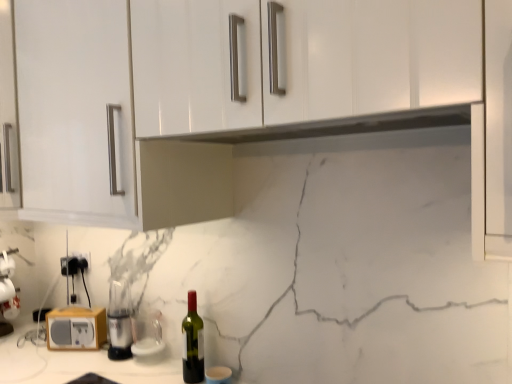
Question: Looking at the image, does black plastic electric outlet at lower left, which is the first electric outlet in right-to-left order, seem bigger or smaller compared to transparent glass at lower center, arranged as the third appliance when viewed from the left?

Choices:
 (A) small
 (B) big

Answer: (A)

Question: Is point (84, 258) closer or farther from the camera than point (159, 357)?

Choices:
 (A) farther
 (B) closer

Answer: (A)

Question: Estimate the real-world distances between objects in this image. Which object is closer to the green glass bottle at center?

Choices:
 (A) metallic silver blender at center, the 2th appliance from the left
 (B) translucent plastic blender at lower left
 (C) wooden radio at lower left, acting as the first appliance starting from the left
 (D) black plastic electric outlet at lower left, the 1th electric outlet in the left-to-right sequence
 (E) transparent glass at lower center, arranged as the third appliance when viewed from the left

Answer: (E)

Question: Which is farther from the wooden radio at lower left, acting as the first appliance starting from the left?

Choices:
 (A) black plastic electric outlet at lower left, the 2th electric outlet when ordered from right to left
 (B) transparent glass at lower center, arranged as the third appliance when viewed from the left
 (C) metallic silver blender at center, the second appliance in the right-to-left sequence
 (D) translucent plastic blender at lower left
 (E) green glass bottle at center

Answer: (D)